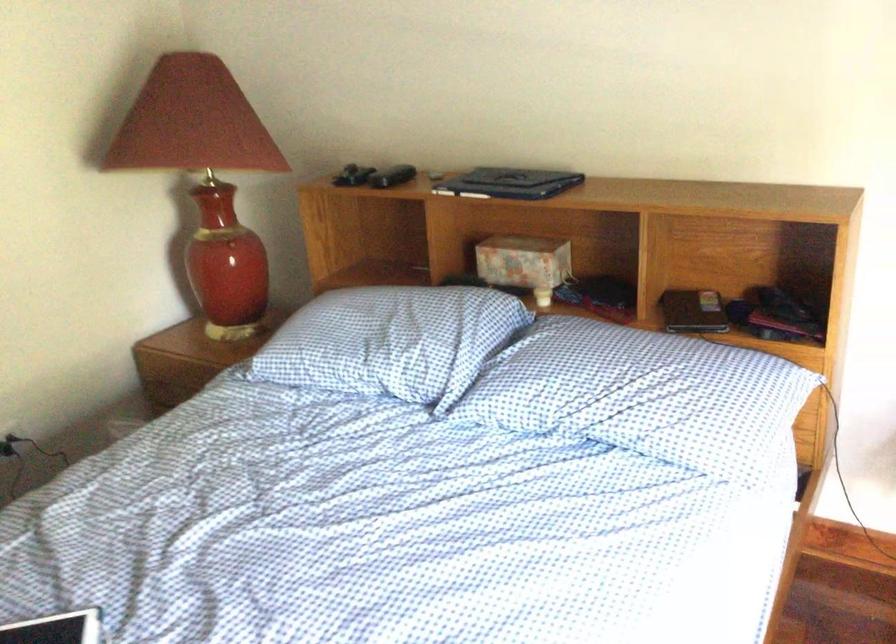
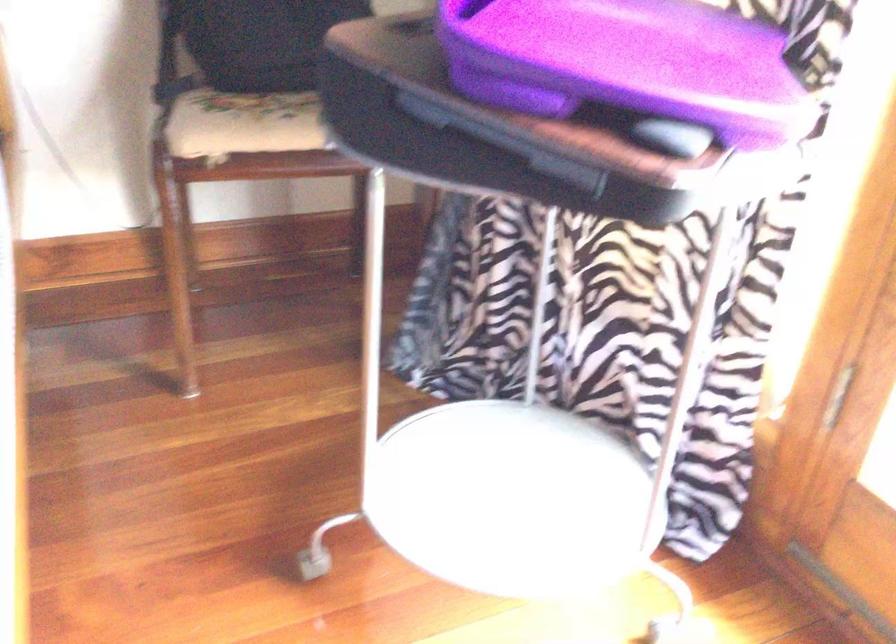
Question: The first image is from the beginning of the video and the second image is from the end. How did the camera likely rotate when shooting the video?

Choices:
 (A) Left
 (B) Right
 (C) Up
 (D) Down

Answer: (B)